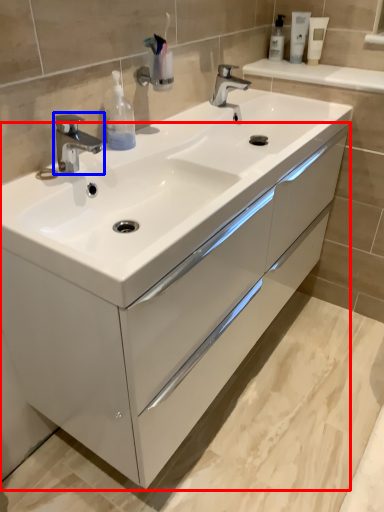
Question: Which object is closer to the camera taking this photo, bathroom cabinet (highlighted by a red box) or tap (highlighted by a blue box)?

Choices:
 (A) bathroom cabinet
 (B) tap

Answer: (A)